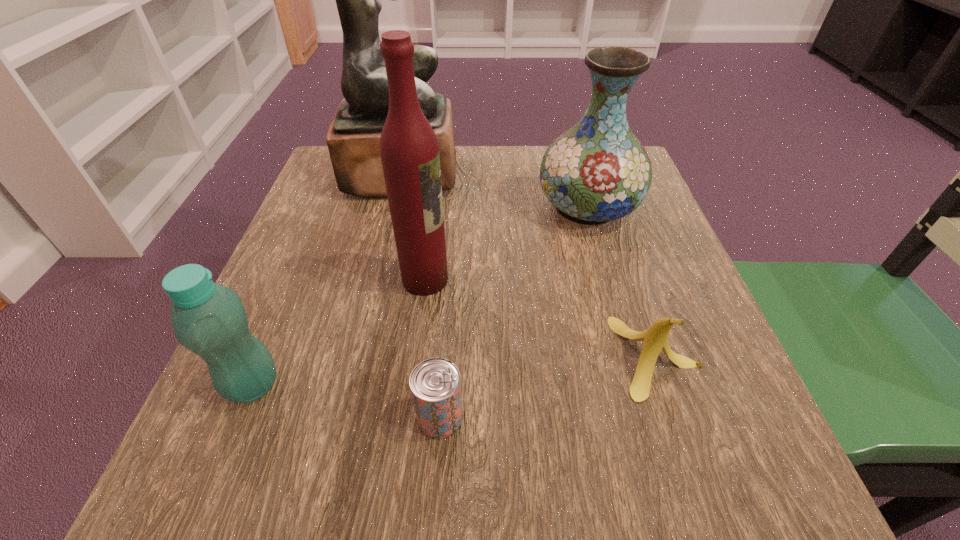
The height and width of the screenshot is (540, 960). What are the coordinates of `free region that satisfies the following two spatial constraints: 1. on the back side of the beer can; 2. in a relaxed pose on the tallest object` in the screenshot? It's located at (457, 174).

Locate an element on the screen. This screenshot has width=960, height=540. vacant space that satisfies the following two spatial constraints: 1. at the front cap of the fourth tallest object; 2. on the left side of the shortest object is located at coordinates pyautogui.click(x=239, y=417).

Find the location of a particular element. The height and width of the screenshot is (540, 960). blank area in the image that satisfies the following two spatial constraints: 1. in a relaxed pose on the tallest object; 2. on the right side of the third tallest object is located at coordinates (395, 207).